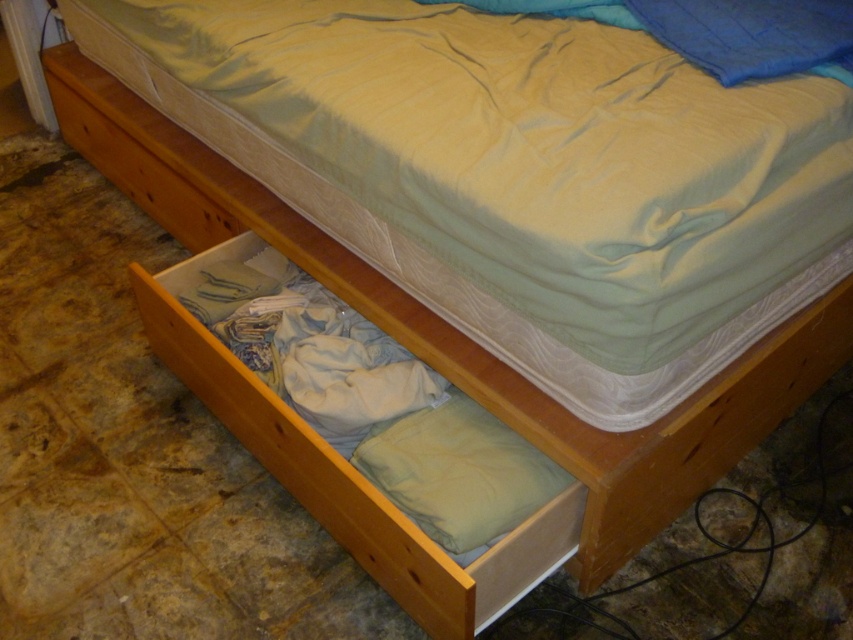
Can you confirm if light brown wood drawer at lower left is taller than light brown wood drawer at lower center?

Yes.

Is light brown wood drawer at lower left bigger than light brown wood drawer at lower center?

Yes.

Is point (347, 477) behind point (126, 144)?

No, it is in front of (126, 144).

Locate an element on the screen. This screenshot has height=640, width=853. light brown wood drawer at lower left is located at coordinates (347, 474).

Does green soft pillow at center appear on the right side of light brown wood drawer at lower center?

Correct, you'll find green soft pillow at center to the right of light brown wood drawer at lower center.

At what (x,y) coordinates should I click in order to perform the action: click on green soft pillow at center. Please return your answer as a coordinate pair (x, y). This screenshot has height=640, width=853. Looking at the image, I should click on (457, 472).

Identify the location of green soft pillow at center. Image resolution: width=853 pixels, height=640 pixels. (457, 472).

Is soft green fabric mattress at center bigger than light brown wood drawer at lower center?

Yes.

Between soft green fabric mattress at center and light brown wood drawer at lower center, which one appears on the right side from the viewer's perspective?

From the viewer's perspective, soft green fabric mattress at center appears more on the right side.

The width and height of the screenshot is (853, 640). Identify the location of soft green fabric mattress at center. (518, 173).